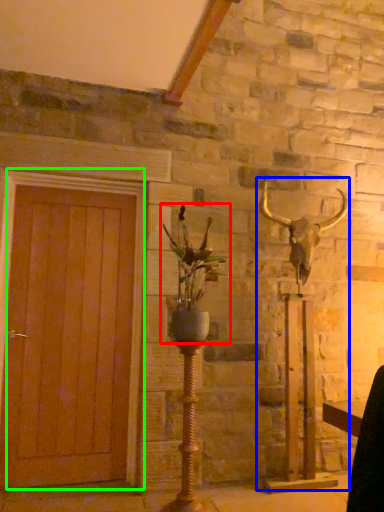
Question: Based on their relative distances, which object is nearer to houseplant (highlighted by a red box)? Choose from sculpture (highlighted by a blue box) and door (highlighted by a green box).

Choices:
 (A) sculpture
 (B) door

Answer: (B)